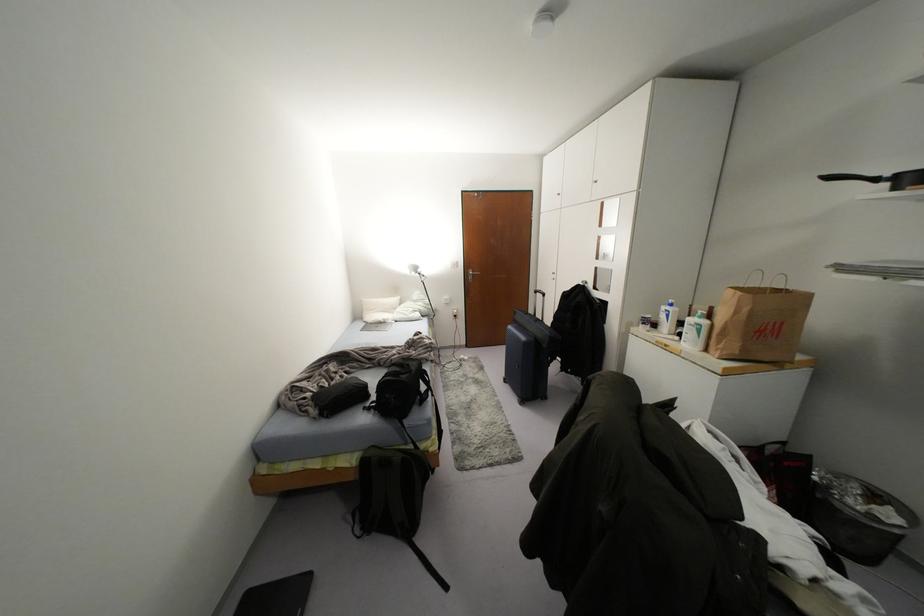
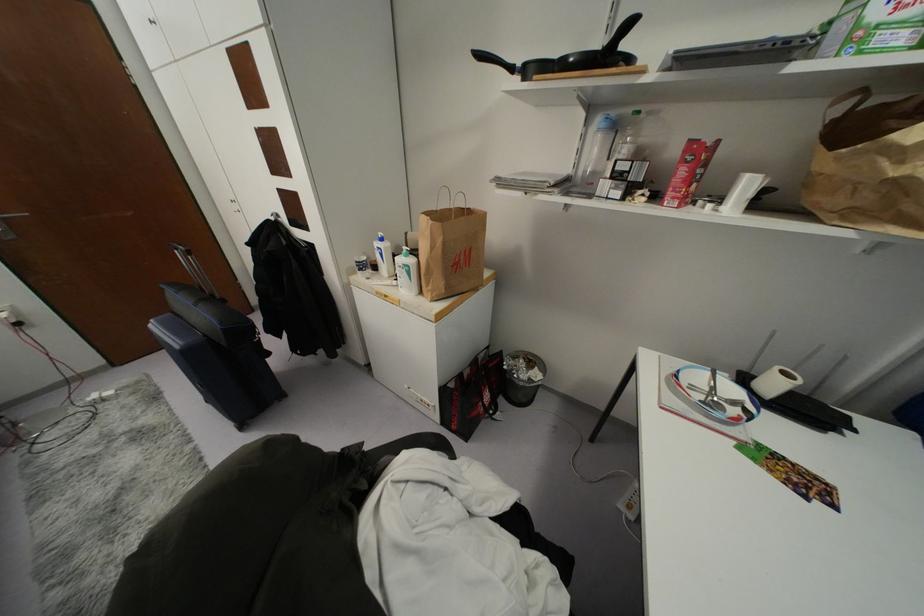
In the second image, find the point that corresponds to the point at 703,322 in the first image.

(410, 261)